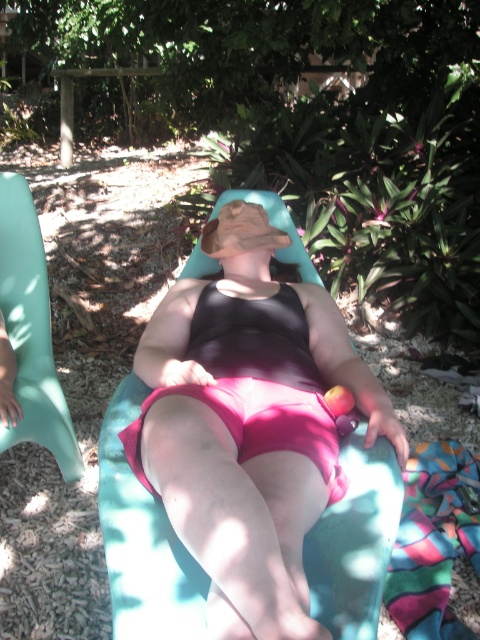
You are a photographer planning to take a photo of the scene. You need to ensure the pink matte swimsuit at center and the teal plastic beach chair at left are both clearly visible. Given their sizes, which object might require more careful framing to avoid being too small in the shot?

The teal plastic beach chair at left is smaller in size compared to the pink matte swimsuit at center, so it might require more careful framing to avoid being too small in the shot.

You are a photographer trying to capture the pink matte swimsuit at center and the teal plastic beach chair at left in a single shot. Based on their positions, which object should you focus on first to ensure both are in frame?

The pink matte swimsuit at center is below the teal plastic beach chair at left, so you should focus on the teal plastic beach chair at left first to ensure both are in frame.